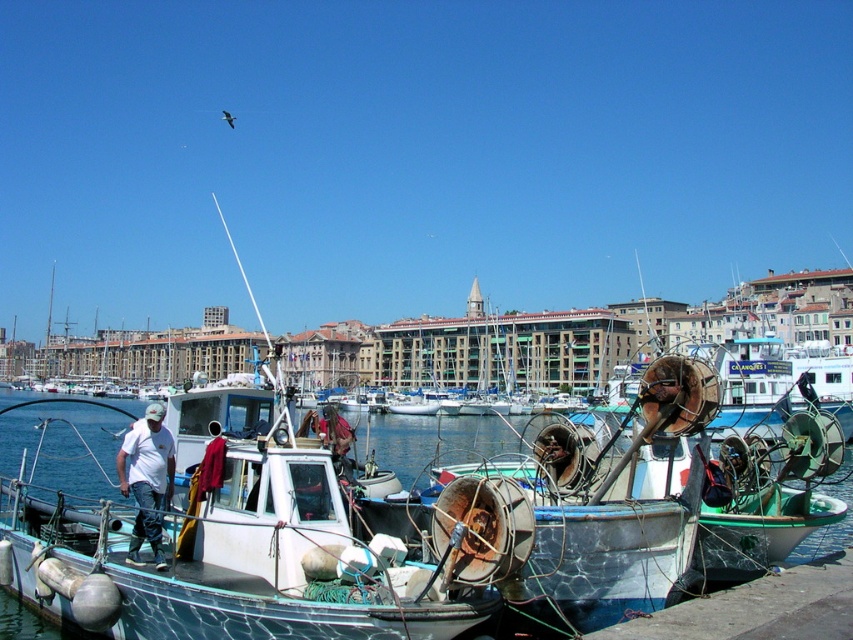
You are a photographer standing at the pier and want to capture both the white matte shirt at center and the rusty metal helmet at center in a single frame. Which object should you focus on first to ensure both are in the frame?

The white matte shirt at center is not as tall as the rusty metal helmet at center, so you should focus on the rusty metal helmet at center first to ensure both are in the frame.

You are standing at the edge of the harbor looking towards the center. There is a point at coordinates point (148, 480). What object is located at that point?

The point (148, 480) is on white matte shirt at center.